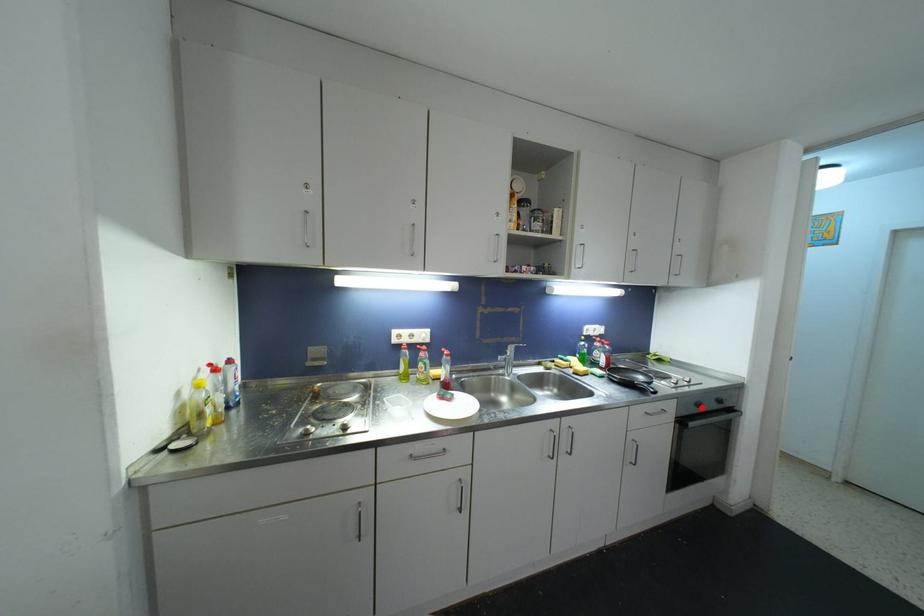
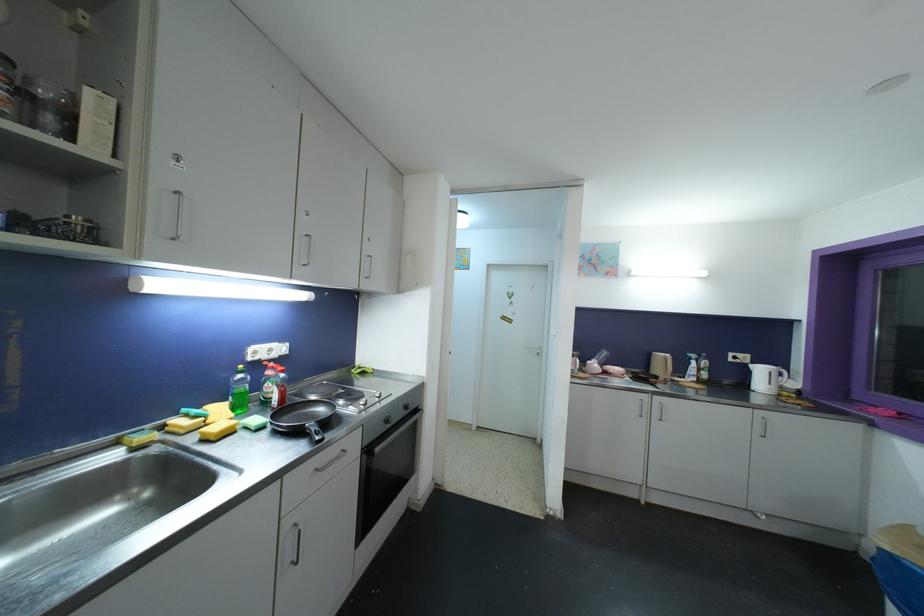
The point at the highlighted location is marked in the first image. Where is the corresponding point in the second image?

(390, 424)